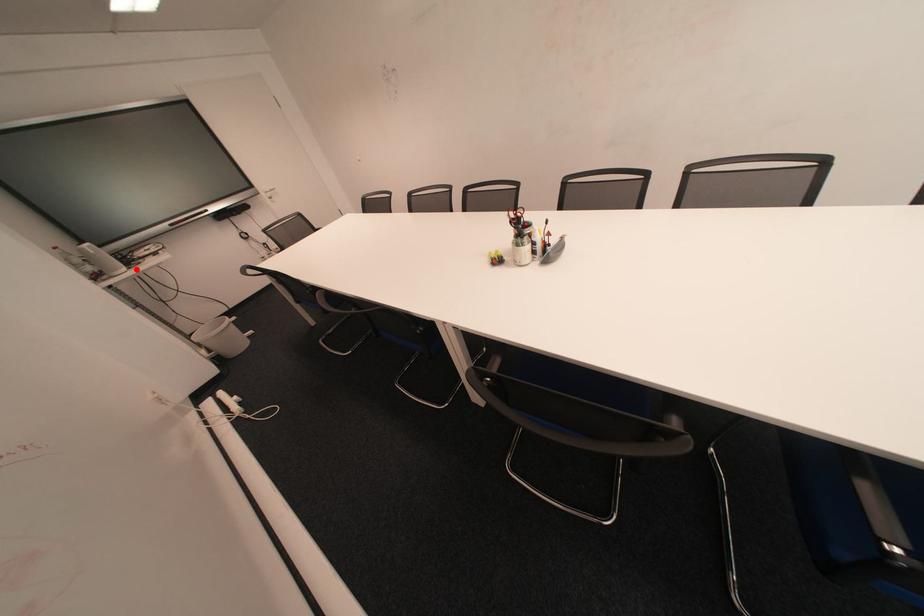
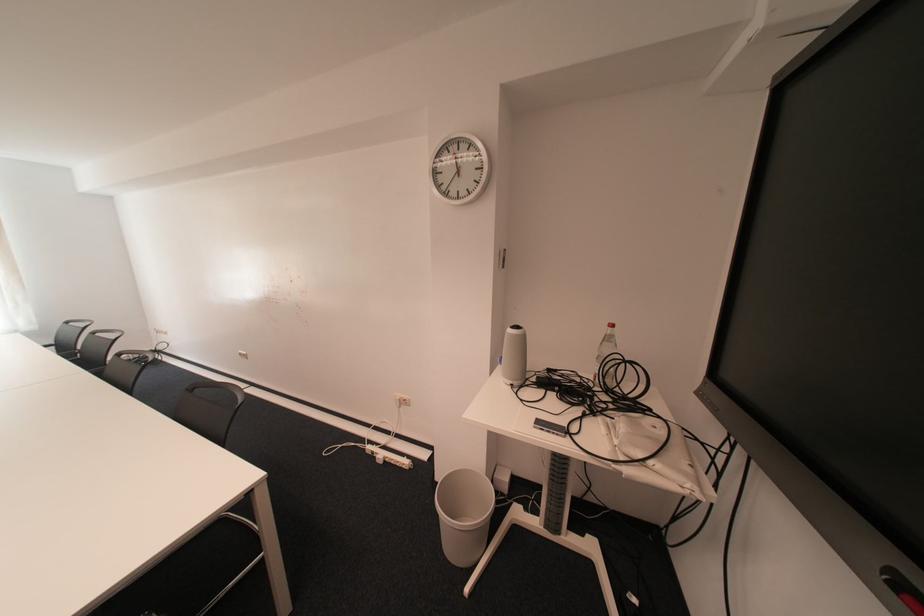
In the second image, find the point that corresponds to the highlighted location in the first image.

(520, 383)